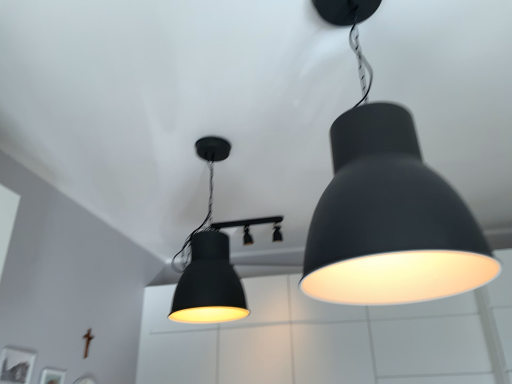
Where is `matte black lampshade at upper right, which ranks as the first lamp in front-to-back order`? This screenshot has width=512, height=384. matte black lampshade at upper right, which ranks as the first lamp in front-to-back order is located at coordinates (389, 220).

Is matte black lampshade at upper right, which ranks as the first lamp in front-to-back order, located outside matte black light fixture at center, the third lamp in the front-to-back sequence?

Yes.

Does point (454, 207) appear closer or farther from the camera than point (252, 219)?

Point (454, 207).

Considering the sizes of objects matte black lampshade at upper right, which ranks as the first lamp in front-to-back order, and matte black light fixture at center, marked as the 1th lamp in a back-to-front arrangement, in the image provided, who is smaller, matte black lampshade at upper right, which ranks as the first lamp in front-to-back order, or matte black light fixture at center, marked as the 1th lamp in a back-to-front arrangement,?

matte black light fixture at center, marked as the 1th lamp in a back-to-front arrangement, is smaller.

At what (x,y) coordinates should I click in order to perform the action: click on the 2nd lamp behind the matte black lampshade at upper right, which ranks as the first lamp in front-to-back order. Please return your answer as a coordinate pair (x, y). Looking at the image, I should click on (252, 224).

Considering the relative sizes of matte black lampshade at center, the 2th lamp when ordered from back to front, and matte black light fixture at center, the third lamp in the front-to-back sequence, in the image provided, is matte black lampshade at center, the 2th lamp when ordered from back to front, wider than matte black light fixture at center, the third lamp in the front-to-back sequence,?

In fact, matte black lampshade at center, the 2th lamp when ordered from back to front, might be narrower than matte black light fixture at center, the third lamp in the front-to-back sequence.

Can you confirm if matte black lampshade at center, acting as the 2th lamp starting from the front, is positioned to the right of matte black light fixture at center, the third lamp in the front-to-back sequence?

Incorrect, matte black lampshade at center, acting as the 2th lamp starting from the front, is not on the right side of matte black light fixture at center, the third lamp in the front-to-back sequence.

From the image's perspective, which one is positioned higher, matte black lampshade at center, the 2th lamp when ordered from back to front, or matte black light fixture at center, the third lamp in the front-to-back sequence?

matte black lampshade at center, the 2th lamp when ordered from back to front, appears higher in the image.

Does matte black lampshade at center, the 2th lamp when ordered from back to front, come in front of matte black lampshade at upper right, which ranks as the first lamp in front-to-back order?

No, it is not.

Which is in front, point (207, 227) or point (336, 119)?

Positioned in front is point (336, 119).

Is matte black lampshade at center, the 2th lamp when ordered from back to front, oriented away from matte black lampshade at upper right, which ranks as the first lamp in front-to-back order?

No, matte black lampshade at upper right, which ranks as the first lamp in front-to-back order, is not at the back of matte black lampshade at center, the 2th lamp when ordered from back to front.

Who is shorter, matte black light fixture at center, marked as the 1th lamp in a back-to-front arrangement, or matte black lampshade at center, the 2th lamp when ordered from back to front?

Standing shorter between the two is matte black light fixture at center, marked as the 1th lamp in a back-to-front arrangement.

Are matte black light fixture at center, the third lamp in the front-to-back sequence, and matte black lampshade at center, the 2th lamp when ordered from back to front, making contact?

matte black light fixture at center, the third lamp in the front-to-back sequence, and matte black lampshade at center, the 2th lamp when ordered from back to front, are clearly separated.

How many degrees apart are the facing directions of matte black light fixture at center, marked as the 1th lamp in a back-to-front arrangement, and matte black lampshade at center, the 2th lamp when ordered from back to front?

The angular difference between matte black light fixture at center, marked as the 1th lamp in a back-to-front arrangement, and matte black lampshade at center, the 2th lamp when ordered from back to front, is 1.23 degrees.

This screenshot has width=512, height=384. In order to click on lamp below the matte black lampshade at center, acting as the 2th lamp starting from the front (from the image's perspective) in this screenshot , I will do `click(252, 224)`.

Is matte black light fixture at center, marked as the 1th lamp in a back-to-front arrangement, situated inside matte black lampshade at upper right, which ranks as the first lamp in front-to-back order, or outside?

matte black light fixture at center, marked as the 1th lamp in a back-to-front arrangement, is not inside matte black lampshade at upper right, which ranks as the first lamp in front-to-back order, it's outside.

Is matte black light fixture at center, marked as the 1th lamp in a back-to-front arrangement, aimed at matte black lampshade at upper right, the third lamp positioned from the back?

No, matte black light fixture at center, marked as the 1th lamp in a back-to-front arrangement, does not turn towards matte black lampshade at upper right, the third lamp positioned from the back.

Who is shorter, matte black lampshade at upper right, which ranks as the first lamp in front-to-back order, or matte black lampshade at center, acting as the 2th lamp starting from the front?

With less height is matte black lampshade at center, acting as the 2th lamp starting from the front.

Which object is further away from the camera taking this photo, matte black lampshade at upper right, the third lamp positioned from the back, or matte black lampshade at center, acting as the 2th lamp starting from the front?

matte black lampshade at center, acting as the 2th lamp starting from the front, is further away from the camera.

From a real-world perspective, who is located higher, matte black lampshade at upper right, which ranks as the first lamp in front-to-back order, or matte black lampshade at center, the 2th lamp when ordered from back to front?

matte black lampshade at center, the 2th lamp when ordered from back to front, is physically above.

Is matte black lampshade at upper right, which ranks as the first lamp in front-to-back order, surrounding matte black lampshade at center, acting as the 2th lamp starting from the front?

No, matte black lampshade at upper right, which ranks as the first lamp in front-to-back order, does not contain matte black lampshade at center, acting as the 2th lamp starting from the front.

The width and height of the screenshot is (512, 384). Find the location of `lamp to the right of matte black light fixture at center, marked as the 1th lamp in a back-to-front arrangement`. lamp to the right of matte black light fixture at center, marked as the 1th lamp in a back-to-front arrangement is located at coordinates (389, 220).

This screenshot has height=384, width=512. I want to click on lamp below the matte black lampshade at center, the 2th lamp when ordered from back to front (from the image's perspective), so click(252, 224).

Which object lies further to the anchor point matte black light fixture at center, the third lamp in the front-to-back sequence, matte black lampshade at center, the 2th lamp when ordered from back to front, or matte black lampshade at upper right, which ranks as the first lamp in front-to-back order?

matte black lampshade at upper right, which ranks as the first lamp in front-to-back order, lies further to matte black light fixture at center, the third lamp in the front-to-back sequence, than the other object.

Considering their positions, is matte black light fixture at center, the third lamp in the front-to-back sequence, positioned further to matte black lampshade at upper right, which ranks as the first lamp in front-to-back order, than matte black lampshade at center, acting as the 2th lamp starting from the front?

The object further to matte black lampshade at upper right, which ranks as the first lamp in front-to-back order, is matte black light fixture at center, the third lamp in the front-to-back sequence.

Which object lies nearer to the anchor point matte black lampshade at upper right, the third lamp positioned from the back, matte black lampshade at center, acting as the 2th lamp starting from the front, or matte black light fixture at center, the third lamp in the front-to-back sequence?

The object closer to matte black lampshade at upper right, the third lamp positioned from the back, is matte black lampshade at center, acting as the 2th lamp starting from the front.

Considering their positions, is matte black light fixture at center, the third lamp in the front-to-back sequence, positioned closer to matte black lampshade at center, the 2th lamp when ordered from back to front, than matte black lampshade at upper right, the third lamp positioned from the back?

Among the two, matte black lampshade at upper right, the third lamp positioned from the back, is located nearer to matte black lampshade at center, the 2th lamp when ordered from back to front.

Considering their positions, is matte black lampshade at upper right, which ranks as the first lamp in front-to-back order, positioned further to matte black lampshade at center, acting as the 2th lamp starting from the front, than matte black light fixture at center, marked as the 1th lamp in a back-to-front arrangement?

Among the two, matte black light fixture at center, marked as the 1th lamp in a back-to-front arrangement, is located further to matte black lampshade at center, acting as the 2th lamp starting from the front.

When comparing their distances from matte black light fixture at center, the third lamp in the front-to-back sequence, does matte black lampshade at upper right, which ranks as the first lamp in front-to-back order, or matte black lampshade at center, acting as the 2th lamp starting from the front, seem further?

Among the two, matte black lampshade at upper right, which ranks as the first lamp in front-to-back order, is located further to matte black light fixture at center, the third lamp in the front-to-back sequence.

At what (x,y) coordinates should I click in order to perform the action: click on lamp between matte black lampshade at upper right, the third lamp positioned from the back, and matte black light fixture at center, marked as the 1th lamp in a back-to-front arrangement, along the z-axis. Please return your answer as a coordinate pair (x, y). Looking at the image, I should click on (211, 259).